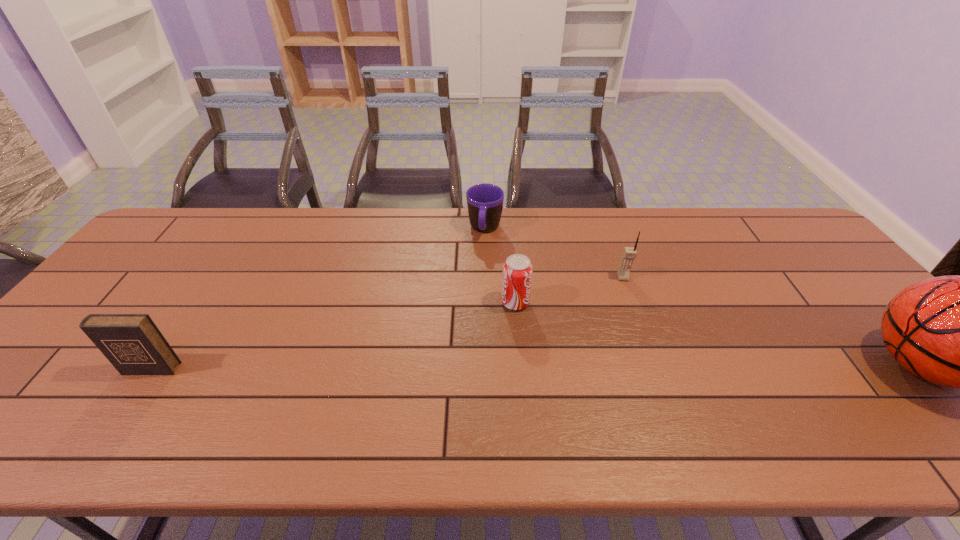
Locate an element on the screen. This screenshot has width=960, height=540. free spot between the diary and the shortest object is located at coordinates (318, 299).

You are a GUI agent. You are given a task and a screenshot of the screen. Output one action in this format:
    pyautogui.click(x=<x>, y=<y>)
    Task: Click on the blank region between the leftmost object and the third nearest object
    This screenshot has width=960, height=540.
    Given the screenshot: What is the action you would take?
    pyautogui.click(x=333, y=335)

Image resolution: width=960 pixels, height=540 pixels. Identify the location of vacant area that lies between the shortest object and the soda can. (500, 266).

Find the location of a particular element. The image size is (960, 540). empty space between the fourth nearest object and the third farthest object is located at coordinates (569, 290).

Find the location of a particular element. This screenshot has width=960, height=540. vacant space in between the leftmost object and the mug is located at coordinates (318, 299).

Identify the location of object that stands as the third closest to the tallest object. Image resolution: width=960 pixels, height=540 pixels. (485, 202).

The width and height of the screenshot is (960, 540). In order to click on the closest object to the fourth nearest object in this screenshot , I will do `click(517, 270)`.